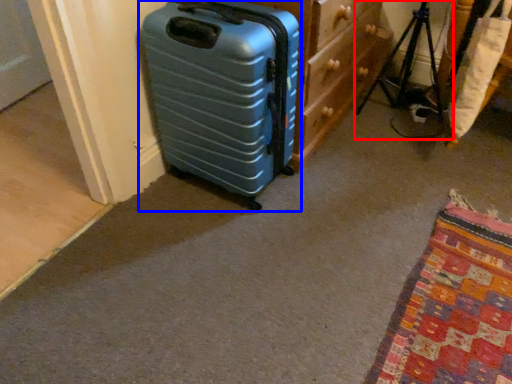
Question: Which object is further to the camera taking this photo, tripod (highlighted by a red box) or suitcase (highlighted by a blue box)?

Choices:
 (A) tripod
 (B) suitcase

Answer: (A)